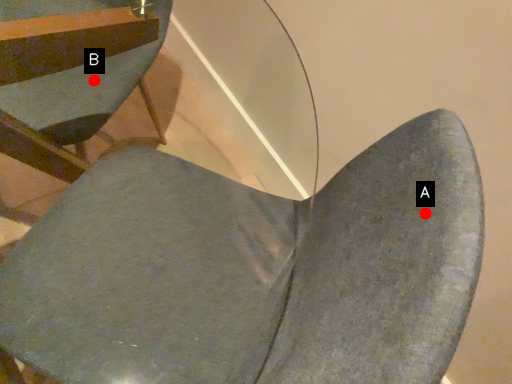
Question: Two points are circled on the image, labeled by A and B beside each circle. Which point is farther from the camera taking this photo?

Choices:
 (A) A is further
 (B) B is further

Answer: (B)